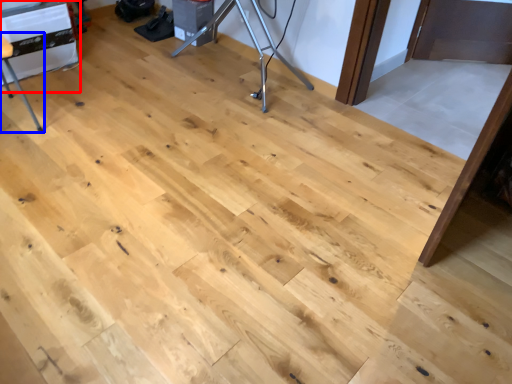
Question: Among these objects, which one is nearest to the camera, table (highlighted by a red box) or furniture (highlighted by a blue box)?

Choices:
 (A) table
 (B) furniture

Answer: (B)